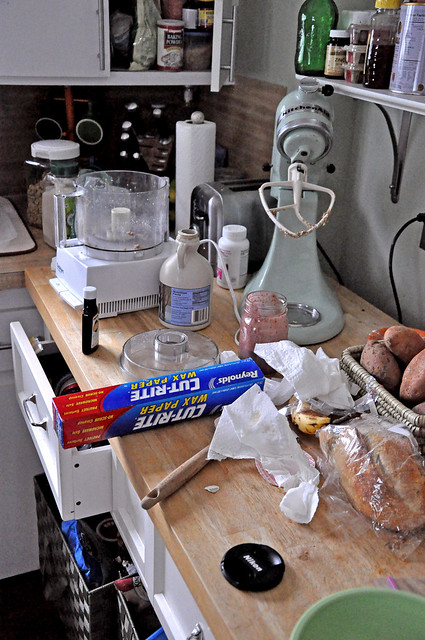
At what (x,y) coordinates should I click in order to perform the action: click on wicker basket. Please return your answer as a coordinate pair (x, y). Image resolution: width=425 pixels, height=640 pixels. Looking at the image, I should click on point(395,401).